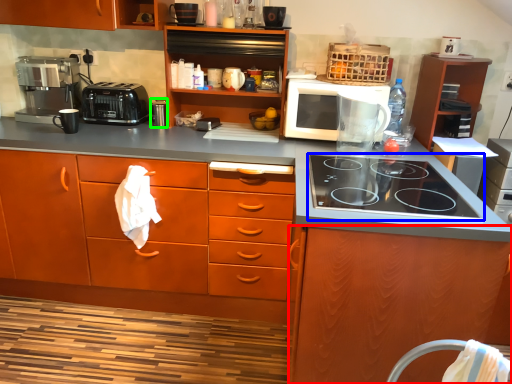
Question: Considering the real-world distances, which object is farthest from cabinetry (highlighted by a red box)? gas stove (highlighted by a blue box) or appliance (highlighted by a green box)?

Choices:
 (A) gas stove
 (B) appliance

Answer: (B)